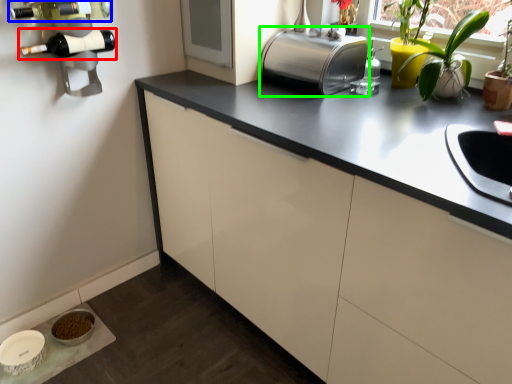
Question: Based on their relative distances, which object is nearer to wine bottle (highlighted by a red box)? Choose from wine bottle (highlighted by a blue box) and toaster (highlighted by a green box).

Choices:
 (A) wine bottle
 (B) toaster

Answer: (A)